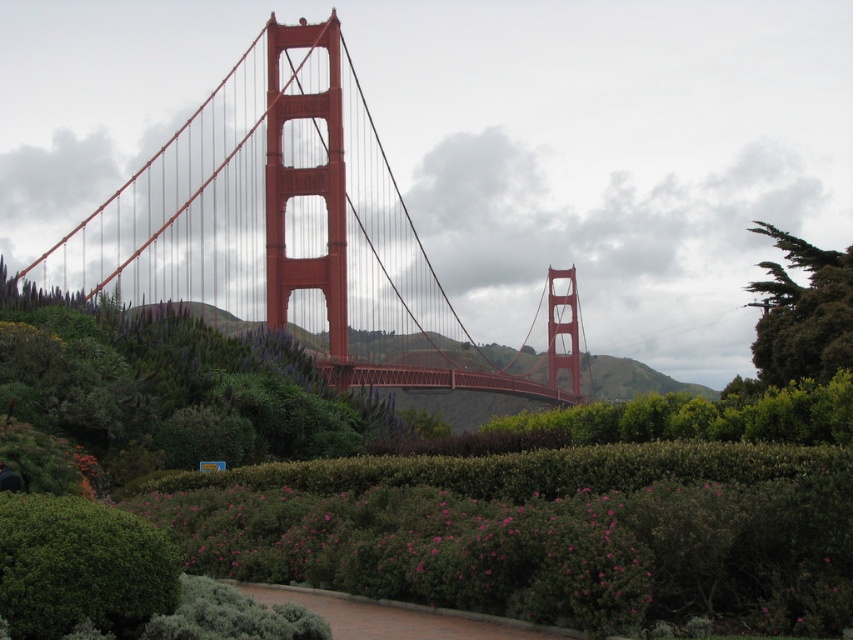
You are standing in a park and want to take a photo of both the glossy steel suspension bridge at center and the green leafy bush at lower left. Which object should you focus on first to ensure both are in the frame?

You should focus on the glossy steel suspension bridge at center first because it is closer to you than the green leafy bush at lower left, so adjusting the camera to include it will naturally include the farther object as well.

You are a drone operator planning to fly a drone from the glossy steel suspension bridge at center to the green textured tree at upper right. The drone has a maximum flight range of 400 feet. Based on the scene, will the drone be able to reach the tree without needing a recharge?

The distance between the glossy steel suspension bridge at center and the green textured tree at upper right is 437.64 feet, which exceeds the drone maximum flight range of 400 feet. Therefore, the drone will not be able to reach the tree without needing a recharge.

You are a photographer planning to capture both the glossy steel suspension bridge at center and the green leafy bush at lower left in a single photo. Given their height difference, which object will appear larger in the photo?

The glossy steel suspension bridge at center will appear larger in the photo because it is much taller than the green leafy bush at lower left.